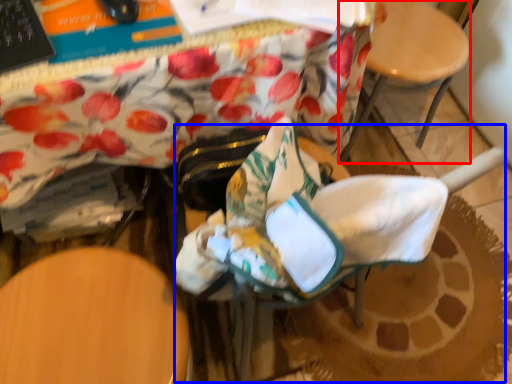
Question: Which object appears farthest to the camera in this image, chair (highlighted by a red box) or rocking chair (highlighted by a blue box)?

Choices:
 (A) chair
 (B) rocking chair

Answer: (A)